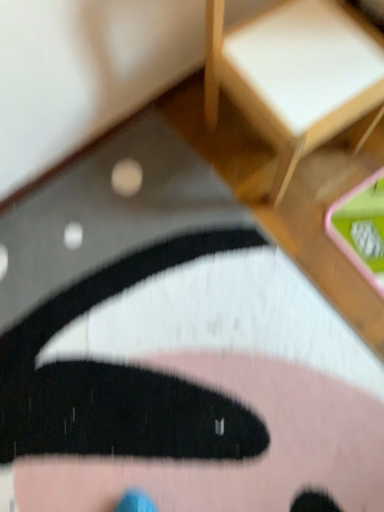
Locate an element on the screen. Image resolution: width=384 pixels, height=512 pixels. vacant area in front of wooden stool at upper right is located at coordinates (289, 239).